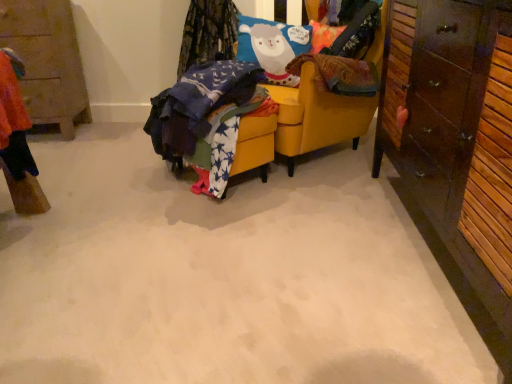
Question: Is the position of yellow fabric chair at center more distant than that of wooden cabinet at left, which ranks as the 2th cabinetry in front-to-back order?

Choices:
 (A) yes
 (B) no

Answer: (B)

Question: From the image's perspective, is yellow fabric chair at center on wooden cabinet at left, which ranks as the 2th cabinetry in front-to-back order?

Choices:
 (A) no
 (B) yes

Answer: (A)

Question: Is yellow fabric chair at center surrounding wooden cabinet at left, which appears as the second cabinetry when viewed from the right?

Choices:
 (A) yes
 (B) no

Answer: (B)

Question: Is yellow fabric chair at center not within wooden cabinet at left, which appears as the first cabinetry when viewed from the back?

Choices:
 (A) yes
 (B) no

Answer: (A)

Question: Is yellow fabric chair at center at the right side of wooden cabinet at left, which appears as the first cabinetry when viewed from the back?

Choices:
 (A) yes
 (B) no

Answer: (A)

Question: Is yellow fabric chair at center taller than wooden cabinet at left, the 1th cabinetry when ordered from left to right?

Choices:
 (A) yes
 (B) no

Answer: (A)

Question: Is wooden cabinet at left, the 1th cabinetry when ordered from left to right, smaller than dark brown wood cabinet at right, acting as the second cabinetry starting from the back?

Choices:
 (A) no
 (B) yes

Answer: (B)

Question: Is wooden cabinet at left, which appears as the second cabinetry when viewed from the right, shorter than dark brown wood cabinet at right, acting as the second cabinetry starting from the back?

Choices:
 (A) yes
 (B) no

Answer: (A)

Question: Can you confirm if wooden cabinet at left, which appears as the first cabinetry when viewed from the back, is bigger than dark brown wood cabinet at right, which is counted as the 1th cabinetry, starting from the right?

Choices:
 (A) no
 (B) yes

Answer: (A)

Question: Does wooden cabinet at left, the 1th cabinetry when ordered from left to right, have a greater height compared to dark brown wood cabinet at right, which is the 2th cabinetry in left-to-right order?

Choices:
 (A) no
 (B) yes

Answer: (A)

Question: Can you confirm if wooden cabinet at left, which ranks as the 2th cabinetry in front-to-back order, is positioned to the right of dark brown wood cabinet at right, the first cabinetry positioned from the front?

Choices:
 (A) yes
 (B) no

Answer: (B)

Question: From a real-world perspective, does wooden cabinet at left, which ranks as the 2th cabinetry in front-to-back order, sit lower than dark brown wood cabinet at right, acting as the second cabinetry starting from the back?

Choices:
 (A) no
 (B) yes

Answer: (B)

Question: Is wooden cabinet at left, which ranks as the 2th cabinetry in front-to-back order, not within star-patterned fabric at center?

Choices:
 (A) no
 (B) yes

Answer: (B)